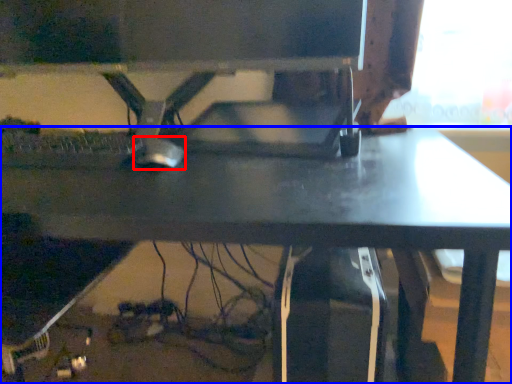
Question: Among these objects, which one is nearest to the camera, mouse (highlighted by a red box) or desk (highlighted by a blue box)?

Choices:
 (A) mouse
 (B) desk

Answer: (B)